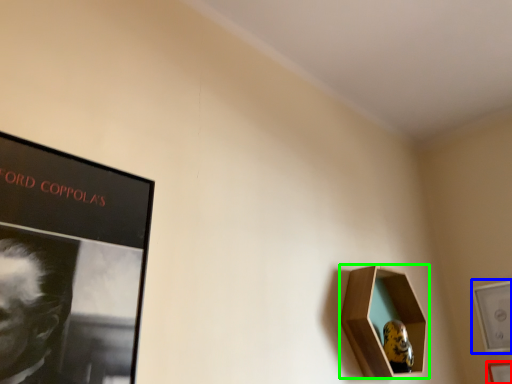
Question: Estimate the real-world distances between objects in this image. Which object is farther from picture frame (highlighted by a red box), picture frame (highlighted by a blue box) or picture frame (highlighted by a green box)?

Choices:
 (A) picture frame
 (B) picture frame

Answer: (B)